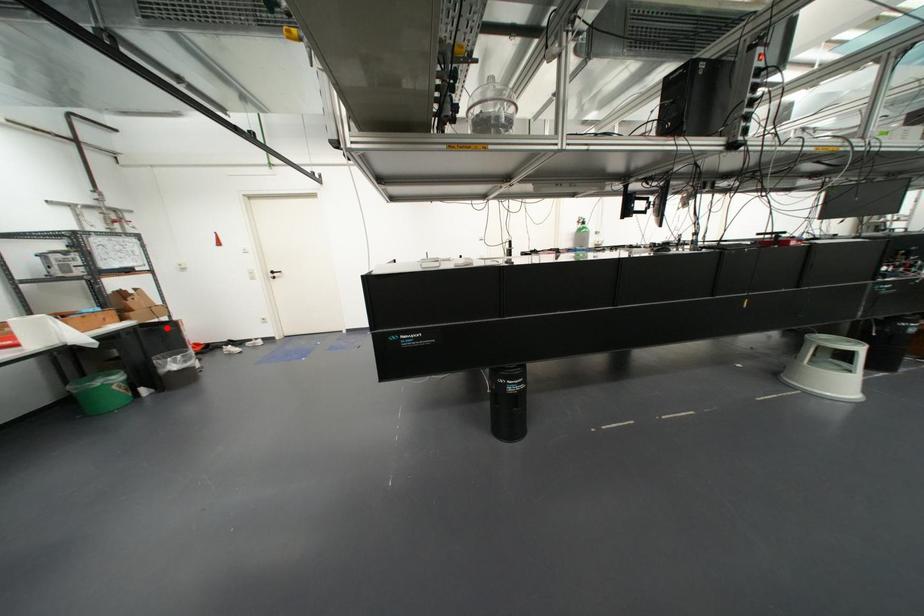
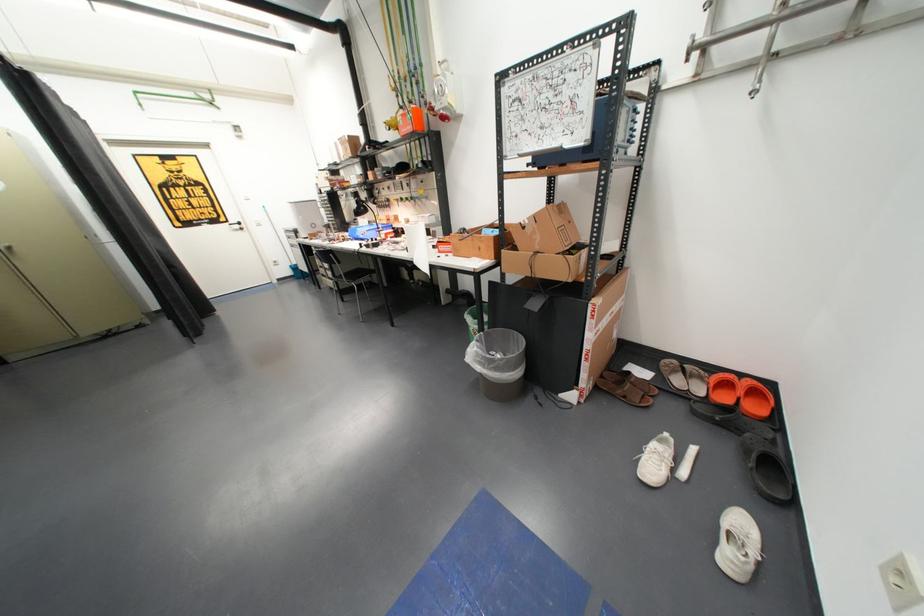
The point at the highlighted location is marked in the first image. Where is the corresponding point in the second image?

(535, 304)